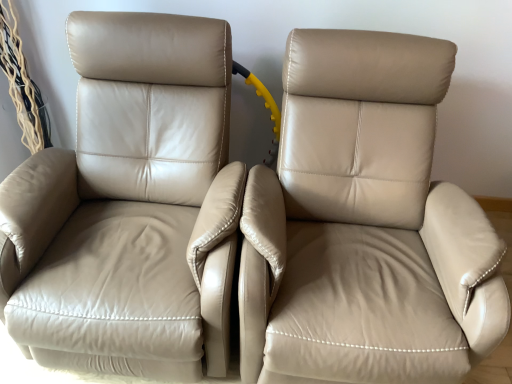
Locate an element on the screen. beige leather chair at center, which is the second chair in left-to-right order is located at coordinates (366, 225).

The image size is (512, 384). What do you see at coordinates (366, 225) in the screenshot?
I see `beige leather chair at center, which is the second chair in left-to-right order` at bounding box center [366, 225].

In order to face beige leather chair at left, the second chair viewed from the right, should I rotate leftwards or rightwards?

You should rotate left by 16.258 degrees.

Describe the element at coordinates (128, 207) in the screenshot. I see `beige leather chair at left, the second chair viewed from the right` at that location.

Where is `beige leather chair at left, the second chair viewed from the right`? This screenshot has height=384, width=512. beige leather chair at left, the second chair viewed from the right is located at coordinates (128, 207).

The width and height of the screenshot is (512, 384). In order to click on beige leather chair at center, acting as the first chair starting from the right in this screenshot , I will do `click(366, 225)`.

Considering the relative positions of beige leather chair at center, acting as the first chair starting from the right, and beige leather chair at left, the second chair viewed from the right, in the image provided, is beige leather chair at center, acting as the first chair starting from the right, to the right of beige leather chair at left, the second chair viewed from the right, from the viewer's perspective?

Indeed, beige leather chair at center, acting as the first chair starting from the right, is positioned on the right side of beige leather chair at left, the second chair viewed from the right.

Considering the positions of objects beige leather chair at center, which is the second chair in left-to-right order, and beige leather chair at left, the second chair viewed from the right, in the image provided, who is behind, beige leather chair at center, which is the second chair in left-to-right order, or beige leather chair at left, the second chair viewed from the right,?

beige leather chair at left, the second chair viewed from the right, is further from the camera.

Is point (390, 64) behind point (113, 31)?

No, it is in front of (113, 31).

Consider the image. From the image's perspective, which one is positioned lower, beige leather chair at center, acting as the first chair starting from the right, or beige leather chair at left, the second chair viewed from the right?

beige leather chair at center, acting as the first chair starting from the right, is shown below in the image.

From a real-world perspective, which object stands above the other?

From a 3D spatial view, beige leather chair at left, positioned as the 1th chair in left-to-right order, is above.

Is beige leather chair at center, acting as the first chair starting from the right, wider or thinner than beige leather chair at left, positioned as the 1th chair in left-to-right order?

Clearly, beige leather chair at center, acting as the first chair starting from the right, has more width compared to beige leather chair at left, positioned as the 1th chair in left-to-right order.

Considering the sizes of objects beige leather chair at center, acting as the first chair starting from the right, and beige leather chair at left, positioned as the 1th chair in left-to-right order, in the image provided, who is shorter, beige leather chair at center, acting as the first chair starting from the right, or beige leather chair at left, positioned as the 1th chair in left-to-right order,?

beige leather chair at left, positioned as the 1th chair in left-to-right order.

Considering the sizes of beige leather chair at center, which is the second chair in left-to-right order, and beige leather chair at left, the second chair viewed from the right, in the image, is beige leather chair at center, which is the second chair in left-to-right order, bigger or smaller than beige leather chair at left, the second chair viewed from the right,?

Clearly, beige leather chair at center, which is the second chair in left-to-right order, is larger in size than beige leather chair at left, the second chair viewed from the right.

Is beige leather chair at center, which is the second chair in left-to-right order, spatially inside beige leather chair at left, the second chair viewed from the right, or outside of it?

beige leather chair at center, which is the second chair in left-to-right order, is spatially situated outside beige leather chair at left, the second chair viewed from the right.

Is beige leather chair at center, acting as the first chair starting from the right, touching beige leather chair at left, positioned as the 1th chair in left-to-right order?

There is a gap between beige leather chair at center, acting as the first chair starting from the right, and beige leather chair at left, positioned as the 1th chair in left-to-right order.

Is beige leather chair at center, acting as the first chair starting from the right, facing towards beige leather chair at left, positioned as the 1th chair in left-to-right order?

No, beige leather chair at center, acting as the first chair starting from the right, is not facing towards beige leather chair at left, positioned as the 1th chair in left-to-right order.

What's the angular difference between beige leather chair at center, which is the second chair in left-to-right order, and beige leather chair at left, the second chair viewed from the right,'s facing directions?

4.53e-05 degrees.

Where is `chair above the beige leather chair at center, which is the second chair in left-to-right order (from a real-world perspective)`? This screenshot has height=384, width=512. chair above the beige leather chair at center, which is the second chair in left-to-right order (from a real-world perspective) is located at coordinates (128, 207).

Can you confirm if beige leather chair at left, the second chair viewed from the right, is positioned to the left of beige leather chair at center, which is the second chair in left-to-right order?

Yes.

Is the depth of beige leather chair at left, the second chair viewed from the right, greater than that of beige leather chair at center, which is the second chair in left-to-right order?

Yes, beige leather chair at left, the second chair viewed from the right, is behind beige leather chair at center, which is the second chair in left-to-right order.

Between point (119, 299) and point (354, 184), which one is positioned behind?

The point (354, 184) is behind.

From the image's perspective, would you say beige leather chair at left, the second chair viewed from the right, is positioned over beige leather chair at center, which is the second chair in left-to-right order?

Yes, from the image's perspective, beige leather chair at left, the second chair viewed from the right, is above beige leather chair at center, which is the second chair in left-to-right order.

From a real-world perspective, relative to beige leather chair at center, acting as the first chair starting from the right, is beige leather chair at left, positioned as the 1th chair in left-to-right order, vertically above or below?

From a real-world perspective, beige leather chair at left, positioned as the 1th chair in left-to-right order, is physically above beige leather chair at center, acting as the first chair starting from the right.

Can you confirm if beige leather chair at left, positioned as the 1th chair in left-to-right order, is thinner than beige leather chair at center, acting as the first chair starting from the right?

Correct, the width of beige leather chair at left, positioned as the 1th chair in left-to-right order, is less than that of beige leather chair at center, acting as the first chair starting from the right.

Between beige leather chair at left, the second chair viewed from the right, and beige leather chair at center, acting as the first chair starting from the right, which one has less height?

beige leather chair at left, the second chair viewed from the right.

In terms of size, does beige leather chair at left, the second chair viewed from the right, appear bigger or smaller than beige leather chair at center, which is the second chair in left-to-right order?

Considering their sizes, beige leather chair at left, the second chair viewed from the right, takes up less space than beige leather chair at center, which is the second chair in left-to-right order.

Can we say beige leather chair at left, the second chair viewed from the right, lies outside beige leather chair at center, acting as the first chair starting from the right?

beige leather chair at left, the second chair viewed from the right, is positioned outside beige leather chair at center, acting as the first chair starting from the right.

Is beige leather chair at left, the second chair viewed from the right, with beige leather chair at center, acting as the first chair starting from the right?

They are not placed beside each other.

Could you tell me if beige leather chair at left, the second chair viewed from the right, is turned towards beige leather chair at center, acting as the first chair starting from the right?

No, beige leather chair at left, the second chair viewed from the right, is not oriented towards beige leather chair at center, acting as the first chair starting from the right.

How many degrees apart are the facing directions of beige leather chair at left, positioned as the 1th chair in left-to-right order, and beige leather chair at center, acting as the first chair starting from the right?

The angle between the facing direction of beige leather chair at left, positioned as the 1th chair in left-to-right order, and the facing direction of beige leather chair at center, acting as the first chair starting from the right, is 4.53e-05 degrees.

Identify the location of chair lying on the left of beige leather chair at center, which is the second chair in left-to-right order. This screenshot has width=512, height=384. (128, 207).

Identify the location of chair on the left of beige leather chair at center, acting as the first chair starting from the right. (128, 207).

Find the location of a particular element. chair that is behind the beige leather chair at center, acting as the first chair starting from the right is located at coordinates (128, 207).